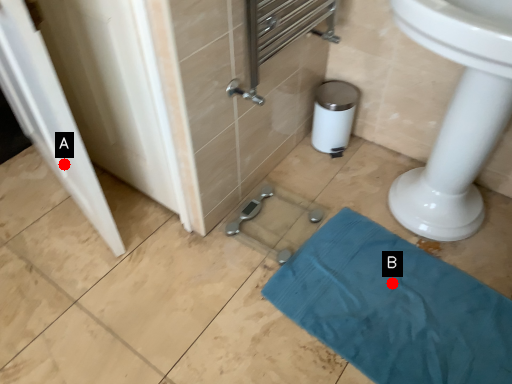
Question: Two points are circled on the image, labeled by A and B beside each circle. Which point is farther to the camera?

Choices:
 (A) A is further
 (B) B is further

Answer: (B)